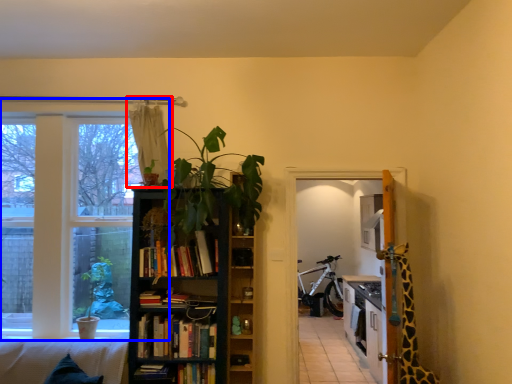
Question: Which point is further to the camera, curtain (highlighted by a red box) or window (highlighted by a blue box)?

Choices:
 (A) curtain
 (B) window

Answer: (B)